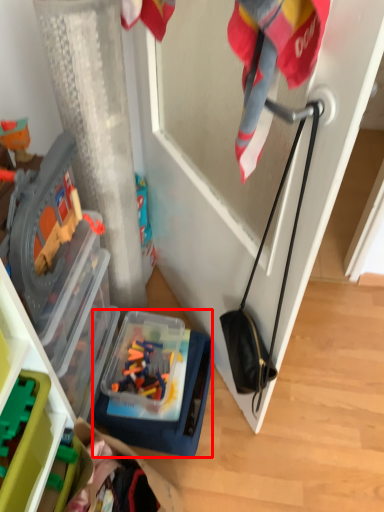
Question: Where is box (annotated by the red box) located in relation to toy in the image?

Choices:
 (A) right
 (B) left

Answer: (A)